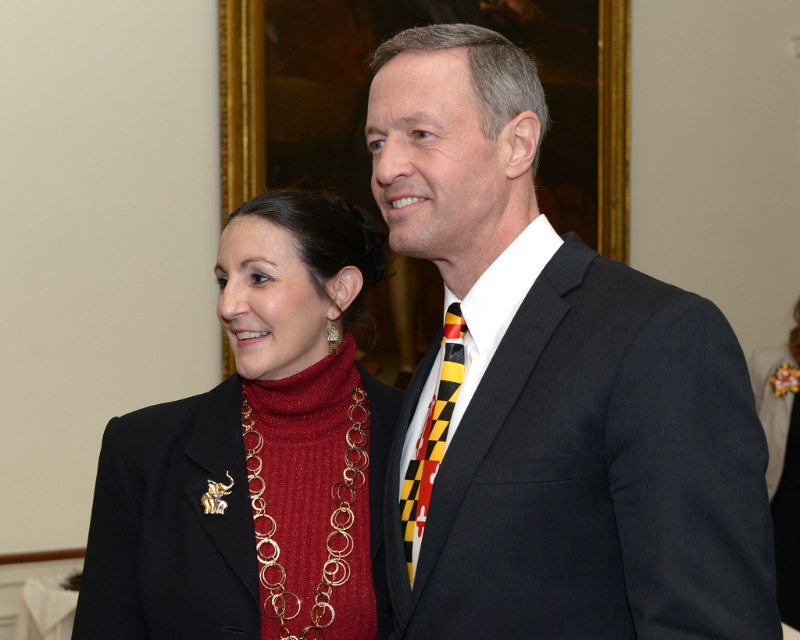
You are a photographer standing 2 meters away from the black suit at center. You want to take a photo of both individuals without moving your position. Can you fit both of them in the frame if your camera has a 50mm lens?

The individuals are 1.25 meters apart, and you are 2 meters away from the black suit at center. A 50mm lens has a field of view that can typically capture subjects within a 46 degree angle. Given the distance and spacing, both individuals should fit comfortably within the frame without needing to move.

You are a photographer preparing to take a group photo of the black suit at center and the shiny gold necklace at center. You want to ensure both are visible in the frame. Considering their sizes, which object should you focus on first to ensure proper focus?

The black suit at center is taller than the shiny gold necklace at center, so you should focus on the black suit at center first since it is larger and requires more attention to ensure proper focus.

You are a photographer at a formal event. You need to adjust the lighting to highlight both the shiny gold necklace at center and the yellow and black striped tie at center. Since the necklace is below the tie, where should you position the light source to ensure both are illuminated without casting harsh shadows?

The shiny gold necklace at center is located below the yellow and black striped tie at center. To illuminate both without harsh shadows, position the light source above and between them, casting even light downward.